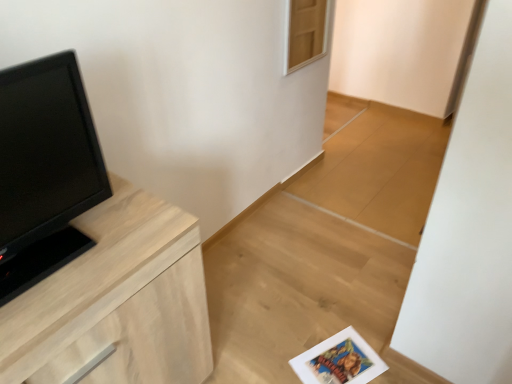
Where is `empty space that is ontop of light wood chest of drawers at left (from a real-world perspective)`? The height and width of the screenshot is (384, 512). empty space that is ontop of light wood chest of drawers at left (from a real-world perspective) is located at coordinates (83, 240).